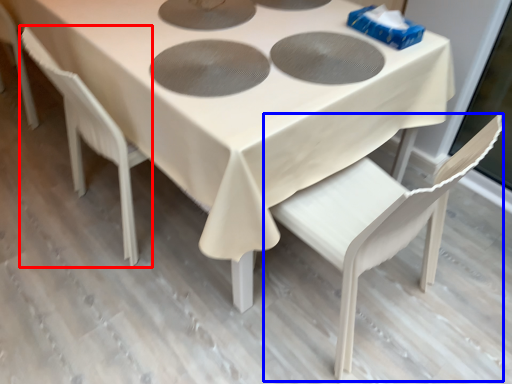
Question: Which of the following is the closest to the observer, chair (highlighted by a red box) or chair (highlighted by a blue box)?

Choices:
 (A) chair
 (B) chair

Answer: (B)